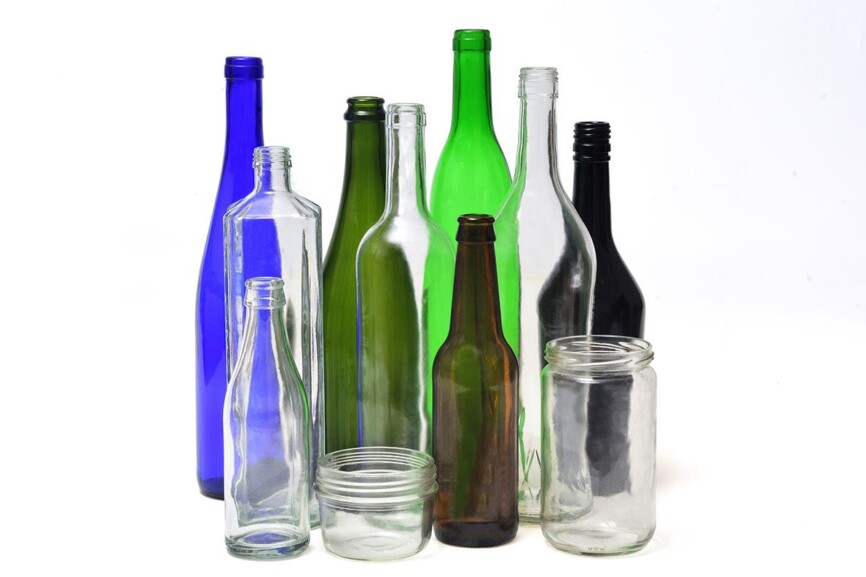
I want to click on bottles, so click(x=262, y=410), click(x=396, y=305), click(x=275, y=233), click(x=253, y=117), click(x=372, y=144), click(x=449, y=114), click(x=475, y=263), click(x=532, y=178), click(x=591, y=208).